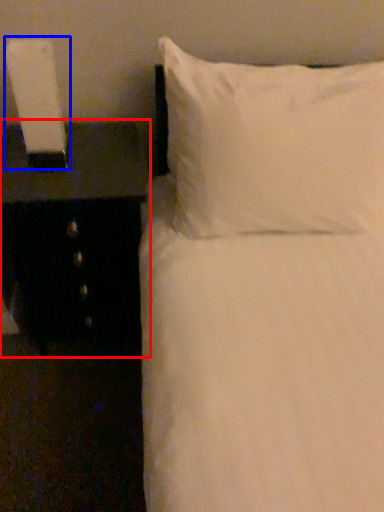
Question: Which object is closer to the camera taking this photo, nightstand (highlighted by a red box) or bedside lamp (highlighted by a blue box)?

Choices:
 (A) nightstand
 (B) bedside lamp

Answer: (B)